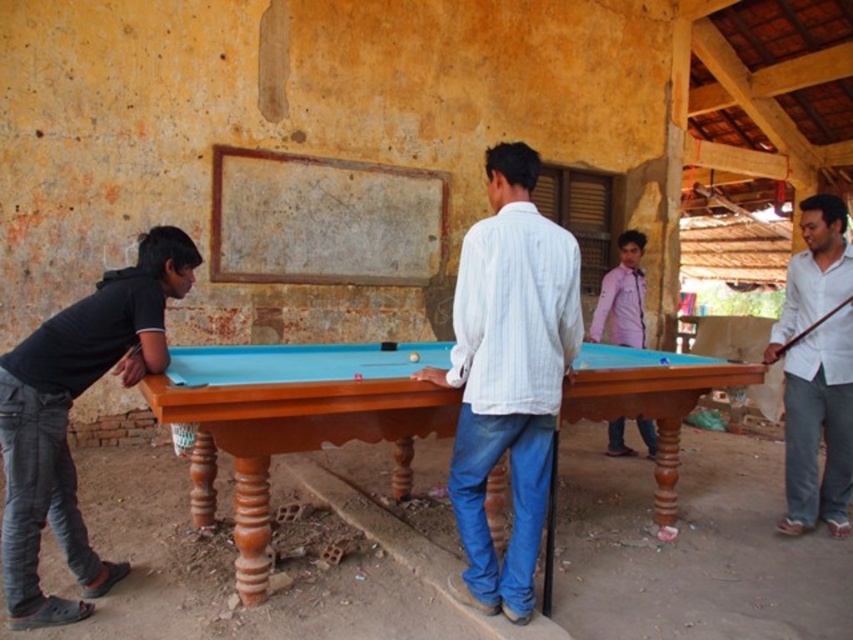
Which is below, teal felt pool table at center or black cotton shirt at left?

teal felt pool table at center is lower down.

Can you confirm if teal felt pool table at center is wider than black cotton shirt at left?

Answer: Correct, the width of teal felt pool table at center exceeds that of black cotton shirt at left.

This screenshot has width=853, height=640. In order to click on teal felt pool table at center in this screenshot , I will do `click(291, 420)`.

You are a GUI agent. You are given a task and a screenshot of the screen. Output one action in this format:
    pyautogui.click(x=<x>, y=<y>)
    Task: Click on the teal felt pool table at center
    
    Given the screenshot: What is the action you would take?
    pyautogui.click(x=291, y=420)

What do you see at coordinates (508, 376) in the screenshot?
I see `white cotton shirt at center` at bounding box center [508, 376].

Is white cotton shirt at center further to the viewer compared to black cotton shirt at left?

No, white cotton shirt at center is closer to the viewer.

Identify the location of white cotton shirt at center. This screenshot has height=640, width=853. (508, 376).

From the picture: Can you confirm if black cotton shirt at left is thinner than pink cotton shirt at center?

In fact, black cotton shirt at left might be wider than pink cotton shirt at center.

Does black cotton shirt at left appear over pink cotton shirt at center?

Incorrect, black cotton shirt at left is not positioned above pink cotton shirt at center.

Describe the element at coordinates (67, 417) in the screenshot. I see `black cotton shirt at left` at that location.

This screenshot has width=853, height=640. In order to click on black cotton shirt at left in this screenshot , I will do `click(67, 417)`.